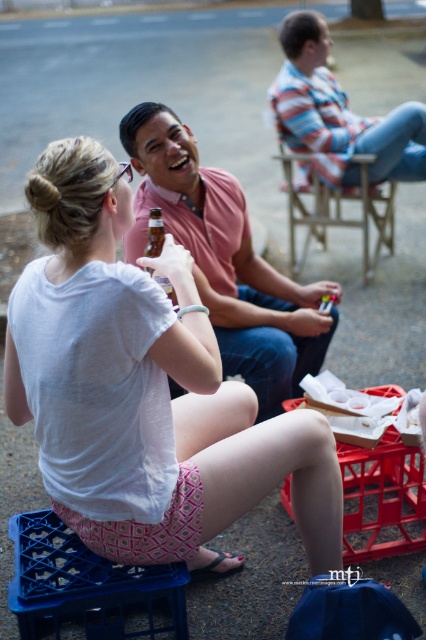
Can you confirm if striped cotton shirt at upper right is positioned above wooden chair at center?

Yes.

Does striped cotton shirt at upper right appear on the right side of wooden chair at center?

Incorrect, striped cotton shirt at upper right is not on the right side of wooden chair at center.

Identify the location of striped cotton shirt at upper right. Image resolution: width=426 pixels, height=640 pixels. (336, 113).

Where is `striped cotton shirt at upper right`? Image resolution: width=426 pixels, height=640 pixels. striped cotton shirt at upper right is located at coordinates (336, 113).

Can you confirm if striped cotton shirt at upper right is positioned above brown glass bottle at center?

Indeed, striped cotton shirt at upper right is positioned over brown glass bottle at center.

Which of these two, striped cotton shirt at upper right or brown glass bottle at center, stands shorter?

brown glass bottle at center

Which is in front, point (279, 122) or point (157, 211)?

Positioned in front is point (157, 211).

The image size is (426, 640). I want to click on striped cotton shirt at upper right, so click(336, 113).

Does wooden chair at center appear under brown glass bottle at center?

Incorrect, wooden chair at center is not positioned below brown glass bottle at center.

Is point (337, 211) positioned after point (152, 269)?

Yes, it is.

Image resolution: width=426 pixels, height=640 pixels. What are the coordinates of `wooden chair at center` in the screenshot? It's located at (336, 209).